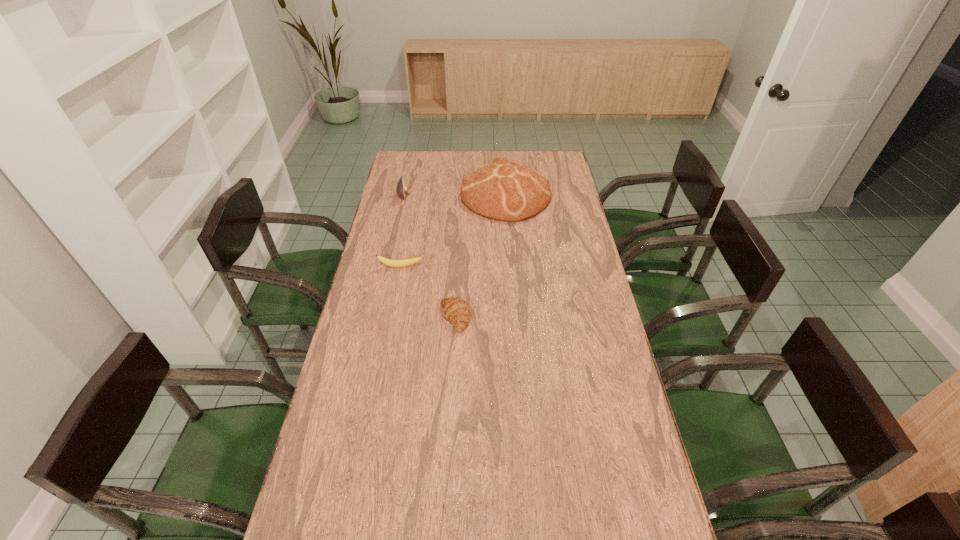
Image resolution: width=960 pixels, height=540 pixels. What are the coordinates of `banana present at the left edge` in the screenshot? It's located at (405, 262).

Image resolution: width=960 pixels, height=540 pixels. Find the location of `object that is at the right edge`. object that is at the right edge is located at coordinates (506, 191).

Image resolution: width=960 pixels, height=540 pixels. Find the location of `object that is at the far right corner`. object that is at the far right corner is located at coordinates (506, 191).

Locate an element on the screen. vacant region at the far edge of the desktop is located at coordinates (518, 157).

The height and width of the screenshot is (540, 960). What are the coordinates of `vacant space at the left edge` in the screenshot? It's located at (385, 311).

Locate an element on the screen. The width and height of the screenshot is (960, 540). free region at the right edge is located at coordinates (600, 406).

Find the location of `free space that is in between the tallest object and the nearest object`. free space that is in between the tallest object and the nearest object is located at coordinates (480, 256).

This screenshot has width=960, height=540. Identify the location of empty space that is in between the second nearest object and the crescent roll. (428, 292).

Image resolution: width=960 pixels, height=540 pixels. Find the location of `free point between the tallest object and the nearest object`. free point between the tallest object and the nearest object is located at coordinates pos(480,256).

Locate an element on the screen. This screenshot has width=960, height=540. vacant region between the crescent roll and the tallest object is located at coordinates (480, 256).